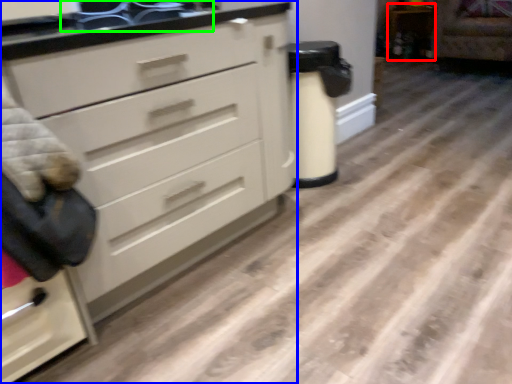
Question: Based on their relative distances, which object is farther from cabinetry (highlighted by a red box)? Choose from chest of drawers (highlighted by a blue box) and sink (highlighted by a green box).

Choices:
 (A) chest of drawers
 (B) sink

Answer: (A)